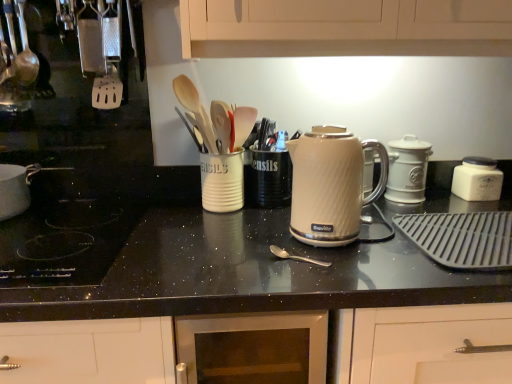
You are a GUI agent. You are given a task and a screenshot of the screen. Output one action in this format:
    pyautogui.click(x=<x>, y=<y>)
    Task: Click on the vacant area that lies between white matte canister at right, which is counted as the 2th kitchen appliance, starting from the right, and white ceramic container at right, which ranks as the 1th kitchen appliance in right-to-left order
    This screenshot has width=512, height=384.
    Given the screenshot: What is the action you would take?
    pyautogui.click(x=446, y=194)